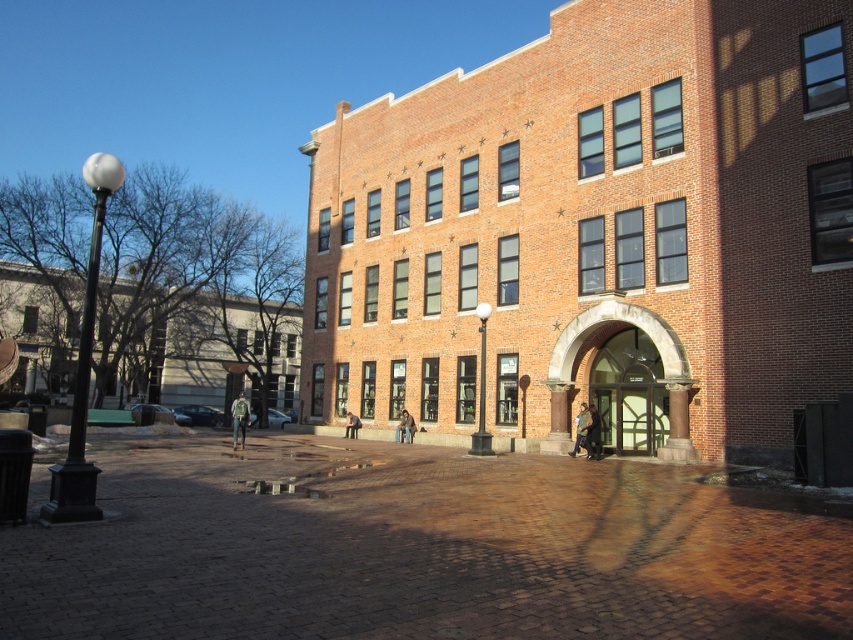
Which is more to the left, brick archway at center or clear glass door at center?

brick archway at center

What do you see at coordinates (659, 355) in the screenshot? The width and height of the screenshot is (853, 640). I see `brick archway at center` at bounding box center [659, 355].

Describe the element at coordinates (659, 355) in the screenshot. I see `brick archway at center` at that location.

Locate an element on the screen. The width and height of the screenshot is (853, 640). brick archway at center is located at coordinates (659, 355).